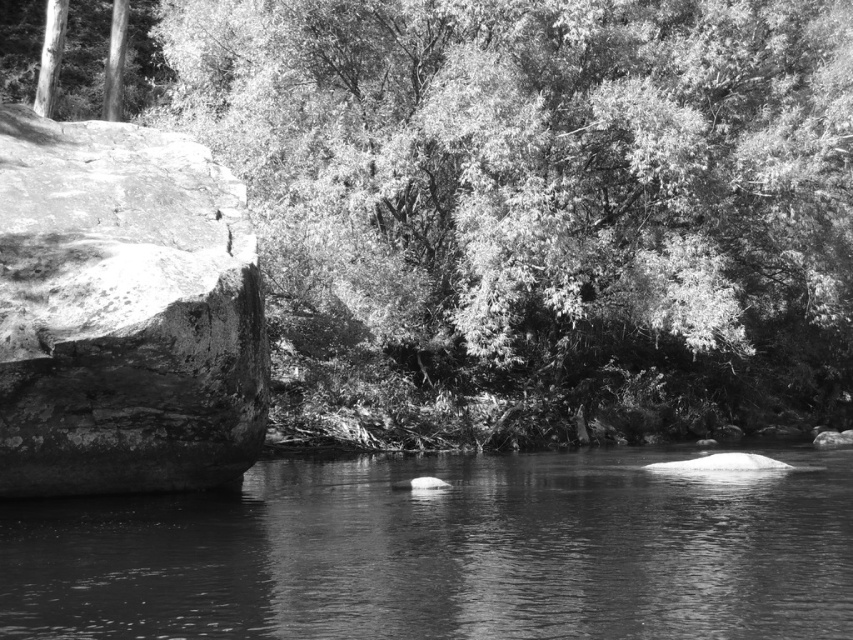
Is smooth green leaves at upper center to the left of smooth water at center from the viewer's perspective?

Correct, you'll find smooth green leaves at upper center to the left of smooth water at center.

Which of these two, smooth green leaves at upper center or smooth water at center, stands taller?

Standing taller between the two is smooth green leaves at upper center.

Measure the distance between smooth green leaves at upper center and camera.

smooth green leaves at upper center is 13.24 meters from camera.

The image size is (853, 640). Identify the location of smooth green leaves at upper center. (532, 209).

Is point (576, 593) in front of point (10, 476)?

Yes, it is in front of point (10, 476).

Who is lower down, smooth water at center or rough textured rock at left?

smooth water at center is lower down.

Is point (310, 550) positioned before point (247, 385)?

That is True.

Where is `smooth water at center`? This screenshot has height=640, width=853. smooth water at center is located at coordinates (445, 554).

Can you confirm if smooth green leaves at upper center is positioned to the right of rough textured rock at left?

Correct, you'll find smooth green leaves at upper center to the right of rough textured rock at left.

Is point (751, 60) farther from viewer compared to point (122, 353)?

That is True.

Image resolution: width=853 pixels, height=640 pixels. Find the location of `smooth green leaves at upper center`. smooth green leaves at upper center is located at coordinates (532, 209).